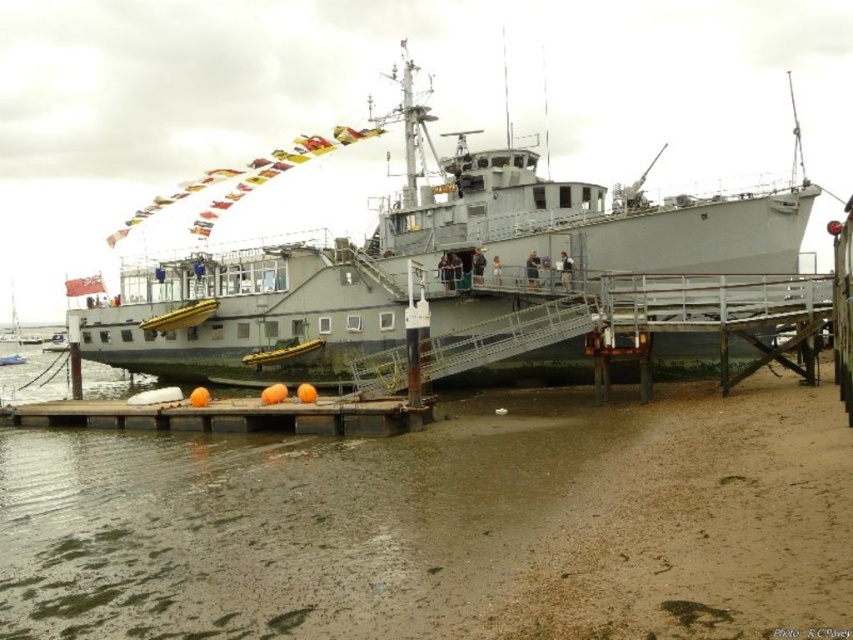
Does brown sand at lower right have a larger size compared to gray matte boat at center?

Incorrect, brown sand at lower right is not larger than gray matte boat at center.

Who is higher up, brown sand at lower right or gray matte boat at center?

gray matte boat at center is higher up.

Who is more forward, (798, 401) or (148, 365)?

Positioned in front is point (798, 401).

Find the location of a particular element. This screenshot has width=853, height=640. brown sand at lower right is located at coordinates (444, 524).

How distant is gray matte boat at center from smooth wooden dock at lower center?

42.28 meters

Does gray matte boat at center appear on the right side of smooth wooden dock at lower center?

Indeed, gray matte boat at center is positioned on the right side of smooth wooden dock at lower center.

This screenshot has width=853, height=640. What do you see at coordinates (428, 262) in the screenshot? I see `gray matte boat at center` at bounding box center [428, 262].

Image resolution: width=853 pixels, height=640 pixels. What are the coordinates of `gray matte boat at center` in the screenshot? It's located at (428, 262).

Consider the image. Does brown sand at lower right have a lesser height compared to smooth wooden dock at lower center?

In fact, brown sand at lower right may be taller than smooth wooden dock at lower center.

I want to click on brown sand at lower right, so (444, 524).